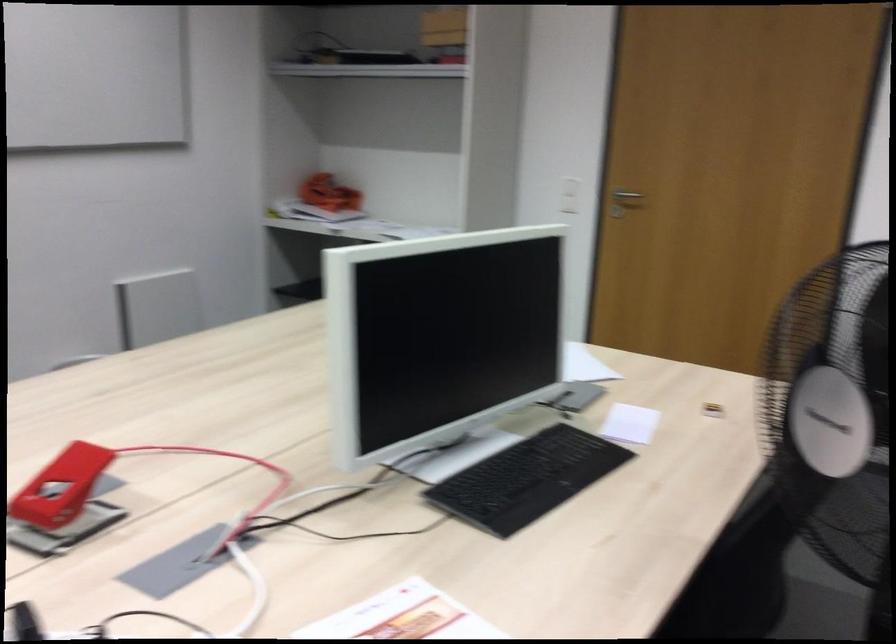
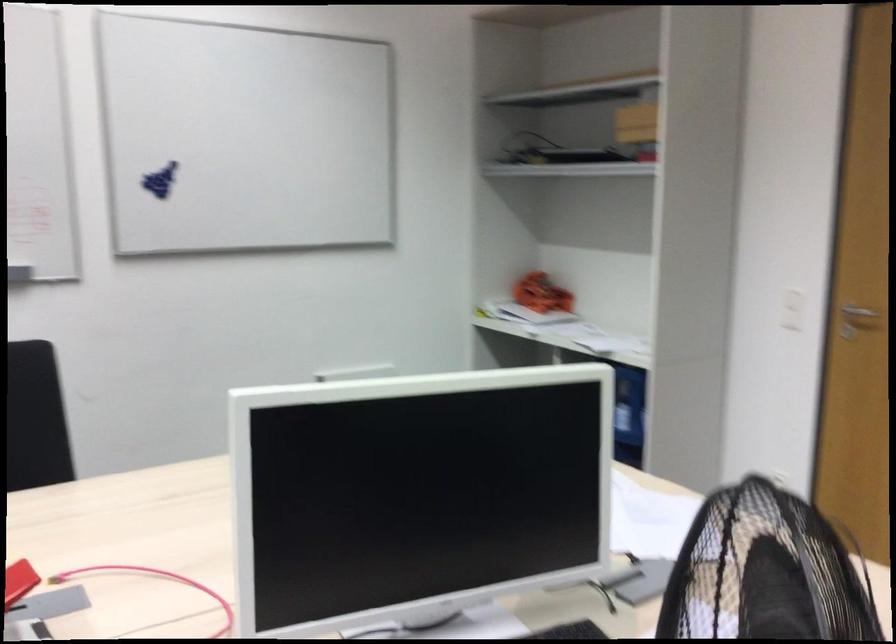
The images are taken continuously from a first-person perspective. In which direction are you moving?

The cameraman walked toward right, forward.